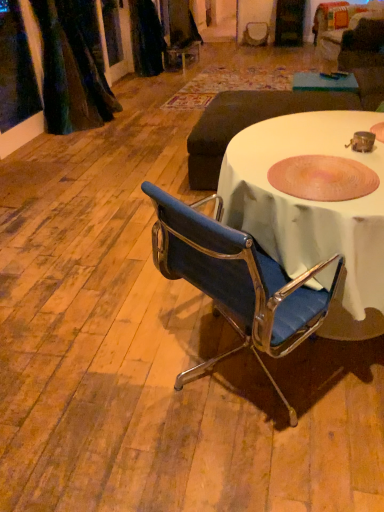
The width and height of the screenshot is (384, 512). What are the coordinates of `free space to the back side of pink textured bowl at center` in the screenshot? It's located at (264, 144).